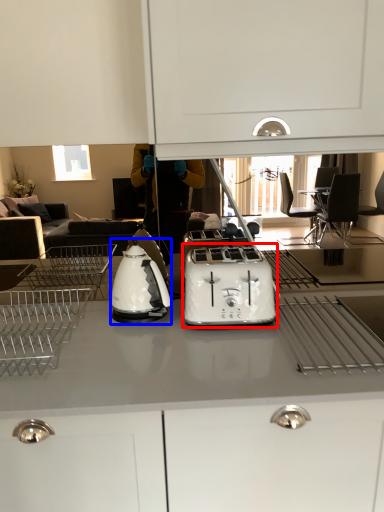
Question: Which object is closer to the camera taking this photo, toaster (highlighted by a red box) or kitchen appliance (highlighted by a blue box)?

Choices:
 (A) toaster
 (B) kitchen appliance

Answer: (A)